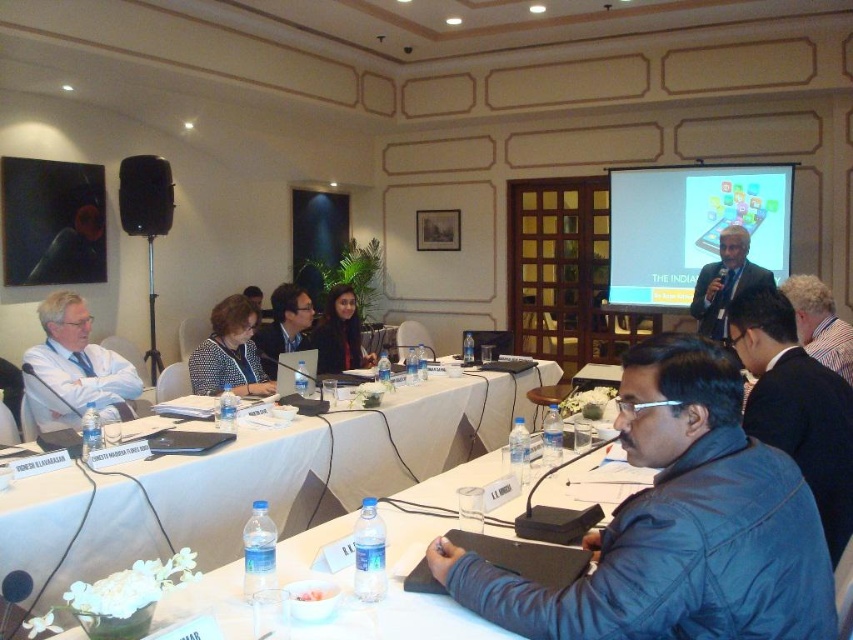
Question: Which of these objects is positioned closest to the blue leather jacket at lower right?

Choices:
 (A) dark blue jacket at lower right
 (B) black plastic speaker at left
 (C) white plastic table at center
 (D) matte black suit at upper right

Answer: (A)

Question: Does matte black screen at upper right lie behind white shirt at left?

Choices:
 (A) yes
 (B) no

Answer: (A)

Question: Among these objects, which one is nearest to the camera?

Choices:
 (A) blue leather jacket at lower right
 (B) patterned fabric shirt at center
 (C) matte black suit at upper right

Answer: (A)

Question: Is black plastic speaker at left thinner than matte black laptop at center?

Choices:
 (A) no
 (B) yes

Answer: (A)

Question: Does dark blue jacket at lower right appear on the left side of matte black laptop at left?

Choices:
 (A) yes
 (B) no

Answer: (B)

Question: Which object appears farthest from the camera in this image?

Choices:
 (A) patterned fabric shirt at center
 (B) matte black laptop at left
 (C) gray striped shirt at lower right

Answer: (B)